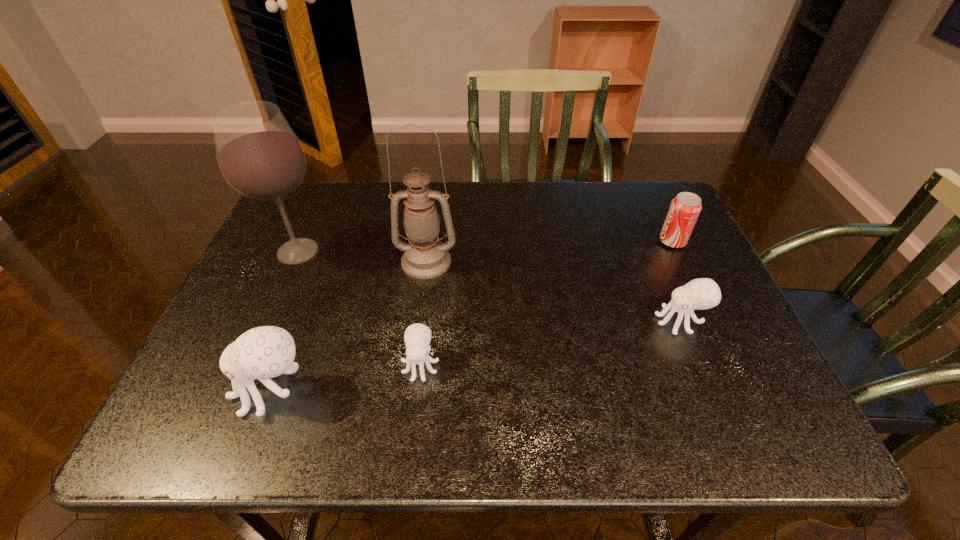
Where is `free point between the fourth farthest object and the soda can`? This screenshot has height=540, width=960. free point between the fourth farthest object and the soda can is located at coordinates (676, 281).

Find the location of a particular element. The height and width of the screenshot is (540, 960). object that is the fifth nearest to the third tallest object is located at coordinates click(684, 210).

I want to click on the closest object to the third nearest object, so click(684, 210).

Point out which octopus is positioned as the third nearest to the alcohol. Please provide its 2D coordinates. Your answer should be formatted as a tuple, i.e. [(x, y)], where the tuple contains the x and y coordinates of a point satisfying the conditions above.

[(703, 293)]

Select which octopus appears as the second closest to the leftmost octopus. Please provide its 2D coordinates. Your answer should be formatted as a tuple, i.e. [(x, y)], where the tuple contains the x and y coordinates of a point satisfying the conditions above.

[(703, 293)]

I want to click on vacant position in the image that satisfies the following two spatial constraints: 1. on the front-facing side of the second tallest octopus; 2. on the front-facing side of the shortest octopus, so click(698, 364).

I want to click on vacant region that satisfies the following two spatial constraints: 1. on the logo side of the soda can; 2. on the front-facing side of the shortest octopus, so click(731, 364).

In order to click on vacant area in the image that satisfies the following two spatial constraints: 1. on the logo side of the soda can; 2. on the front side of the oil lamp in this screenshot , I will do `click(682, 261)`.

Where is `free spot that satisfies the following two spatial constraints: 1. on the front side of the alcohol; 2. on the left side of the oil lamp`? free spot that satisfies the following two spatial constraints: 1. on the front side of the alcohol; 2. on the left side of the oil lamp is located at coordinates (294, 261).